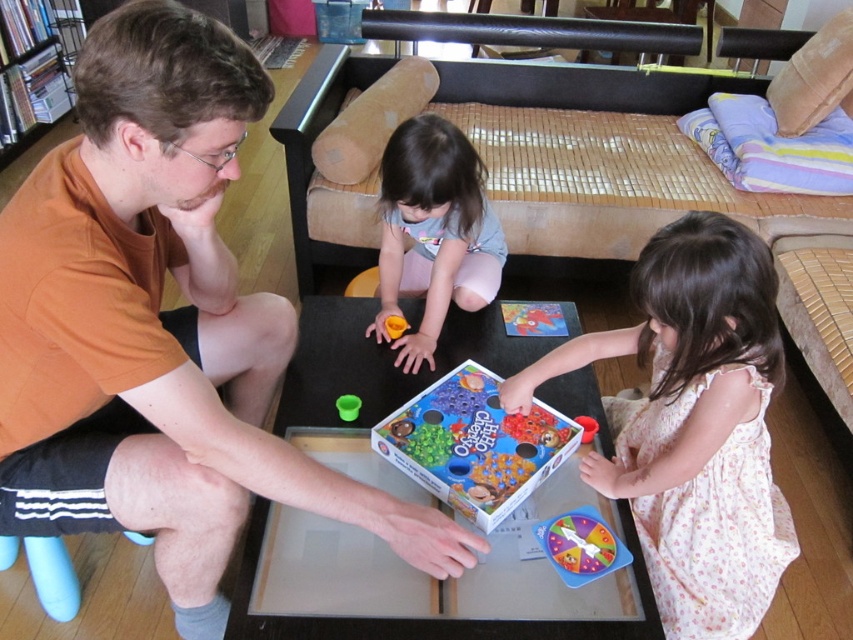
Question: Considering the relative positions of orange t-shirt at upper left and yellow plastic toy at center in the image provided, where is orange t-shirt at upper left located with respect to yellow plastic toy at center?

Choices:
 (A) left
 (B) right

Answer: (A)

Question: Considering the relative positions of metallic silver bookshelf at left and translucent plastic spinner at center in the image provided, where is metallic silver bookshelf at left located with respect to translucent plastic spinner at center?

Choices:
 (A) right
 (B) left

Answer: (B)

Question: Among these objects, which one is farthest from the camera?

Choices:
 (A) orange t-shirt at upper left
 (B) translucent plastic spinner at center
 (C) green matte cup at center

Answer: (C)

Question: Among these points, which one is nearest to the camera?

Choices:
 (A) (566, 632)
 (B) (563, 442)
 (C) (434, 244)
 (D) (579, 422)

Answer: (A)

Question: Is white floral dress at center to the left of light blue fabric pants at center from the viewer's perspective?

Choices:
 (A) yes
 (B) no

Answer: (B)

Question: Estimate the real-world distances between objects in this image. Which object is closer to the yellow plastic toy at center?

Choices:
 (A) light blue fabric pants at center
 (B) translucent plastic spinner at center
 (C) plastic spinner at center

Answer: (A)